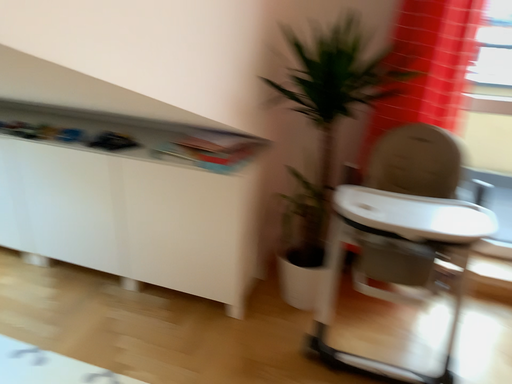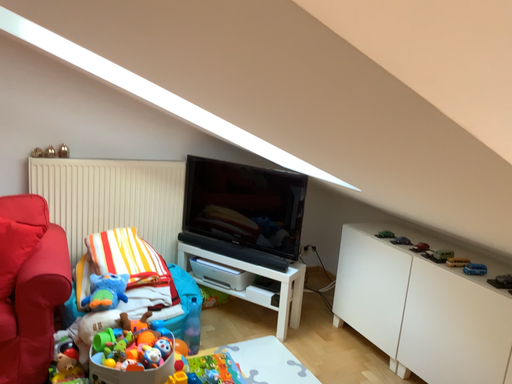
Question: Which way did the camera rotate in the video?

Choices:
 (A) rotated left
 (B) rotated right

Answer: (A)